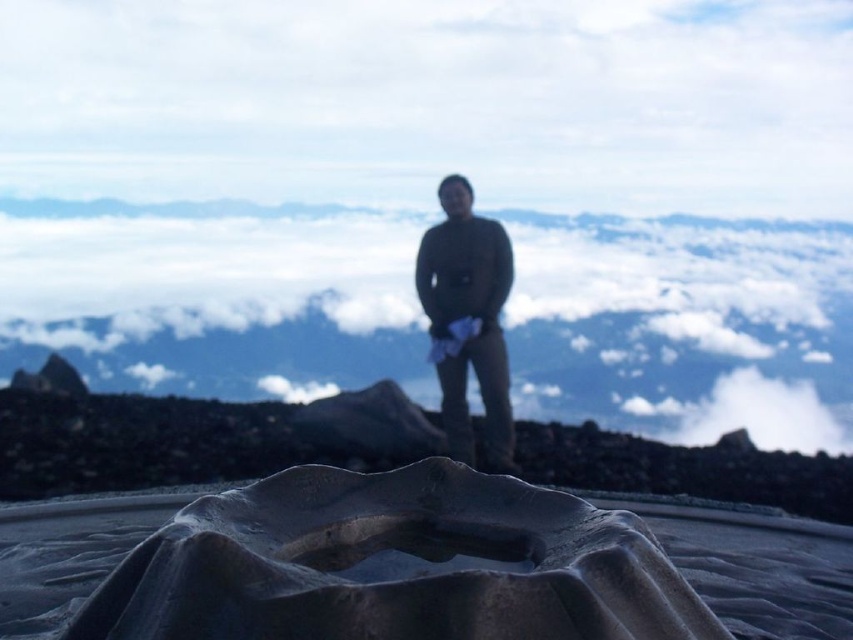
Is point (511, 568) positioned behind point (450, 284)?

That is False.

Does point (461, 612) come behind point (461, 193)?

No, it is in front of (461, 193).

Identify the location of silvery metallic blanket at center. This screenshot has width=853, height=640. (395, 564).

Does rough textured rock at center have a greater width compared to dark green sweater at center?

Indeed, rough textured rock at center has a greater width compared to dark green sweater at center.

What do you see at coordinates (195, 438) in the screenshot? This screenshot has height=640, width=853. I see `rough textured rock at center` at bounding box center [195, 438].

This screenshot has height=640, width=853. What are the coordinates of `rough textured rock at center` in the screenshot? It's located at (195, 438).

Based on the photo, which is above, white fluffy cloud at upper center or rough textured rock at center?

Positioned higher is white fluffy cloud at upper center.

Measure the distance between white fluffy cloud at upper center and rough textured rock at center.

white fluffy cloud at upper center and rough textured rock at center are 1.48 inches apart.

Identify the location of white fluffy cloud at upper center. This screenshot has height=640, width=853. (213, 296).